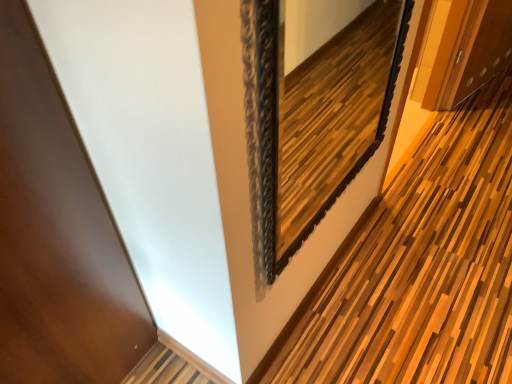
Question: From a real-world perspective, is wooden slats at center positioned over black ornate mirror at upper center based on gravity?

Choices:
 (A) yes
 (B) no

Answer: (B)

Question: Considering the relative positions of wooden slats at center and black ornate mirror at upper center in the image provided, is wooden slats at center to the right of black ornate mirror at upper center from the viewer's perspective?

Choices:
 (A) no
 (B) yes

Answer: (B)

Question: Is wooden slats at center outside of black ornate mirror at upper center?

Choices:
 (A) yes
 (B) no

Answer: (A)

Question: Does wooden slats at center turn towards black ornate mirror at upper center?

Choices:
 (A) yes
 (B) no

Answer: (B)

Question: Is wooden slats at center to the left of black ornate mirror at upper center from the viewer's perspective?

Choices:
 (A) yes
 (B) no

Answer: (B)

Question: Is there a large distance between wooden slats at center and black ornate mirror at upper center?

Choices:
 (A) yes
 (B) no

Answer: (B)

Question: Considering the relative sizes of black ornate mirror at upper center and wooden slats at center in the image provided, is black ornate mirror at upper center bigger than wooden slats at center?

Choices:
 (A) yes
 (B) no

Answer: (A)

Question: From the image's perspective, is black ornate mirror at upper center below wooden slats at center?

Choices:
 (A) no
 (B) yes

Answer: (A)

Question: Is the surface of black ornate mirror at upper center in direct contact with wooden slats at center?

Choices:
 (A) yes
 (B) no

Answer: (B)

Question: Is wooden slats at center inside black ornate mirror at upper center?

Choices:
 (A) no
 (B) yes

Answer: (A)

Question: Considering the relative positions of black ornate mirror at upper center and wooden slats at center in the image provided, is black ornate mirror at upper center to the left of wooden slats at center from the viewer's perspective?

Choices:
 (A) no
 (B) yes

Answer: (B)

Question: Is black ornate mirror at upper center taller than wooden slats at center?

Choices:
 (A) no
 (B) yes

Answer: (B)

Question: Does point (288, 87) appear closer or farther from the camera than point (414, 339)?

Choices:
 (A) farther
 (B) closer

Answer: (A)